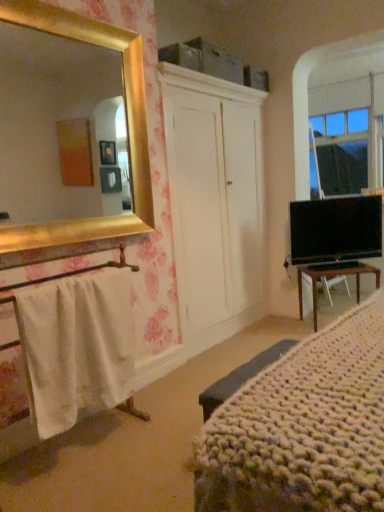
Question: Can you confirm if black glossy tv at right is positioned to the right of brown wooden desk at lower right?

Choices:
 (A) yes
 (B) no

Answer: (B)

Question: From the image's perspective, is black glossy tv at right under brown wooden desk at lower right?

Choices:
 (A) yes
 (B) no

Answer: (B)

Question: Can you confirm if black glossy tv at right is wider than brown wooden desk at lower right?

Choices:
 (A) no
 (B) yes

Answer: (A)

Question: Can you see black glossy tv at right touching brown wooden desk at lower right?

Choices:
 (A) no
 (B) yes

Answer: (A)

Question: Could you tell me if black glossy tv at right is turned towards brown wooden desk at lower right?

Choices:
 (A) yes
 (B) no

Answer: (B)

Question: From the image's perspective, is black glossy tv at right over brown wooden desk at lower right?

Choices:
 (A) yes
 (B) no

Answer: (A)

Question: Considering the relative positions of brown wooden desk at lower right and white cotton towel at left in the image provided, is brown wooden desk at lower right behind white cotton towel at left?

Choices:
 (A) yes
 (B) no

Answer: (A)

Question: Does brown wooden desk at lower right have a smaller size compared to white cotton towel at left?

Choices:
 (A) yes
 (B) no

Answer: (B)

Question: From a real-world perspective, is brown wooden desk at lower right located higher than white cotton towel at left?

Choices:
 (A) no
 (B) yes

Answer: (A)

Question: Would you say brown wooden desk at lower right is outside white cotton towel at left?

Choices:
 (A) no
 (B) yes

Answer: (B)

Question: Is brown wooden desk at lower right to the right of white cotton towel at left from the viewer's perspective?

Choices:
 (A) yes
 (B) no

Answer: (A)

Question: Is white cotton towel at left surrounded by brown wooden desk at lower right?

Choices:
 (A) no
 (B) yes

Answer: (A)

Question: Is white cotton towel at left looking in the opposite direction of knitted fabric bed at lower right?

Choices:
 (A) no
 (B) yes

Answer: (A)